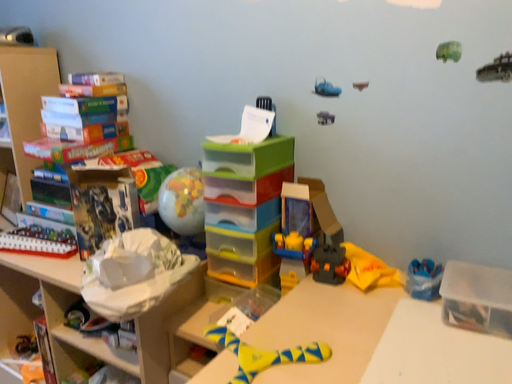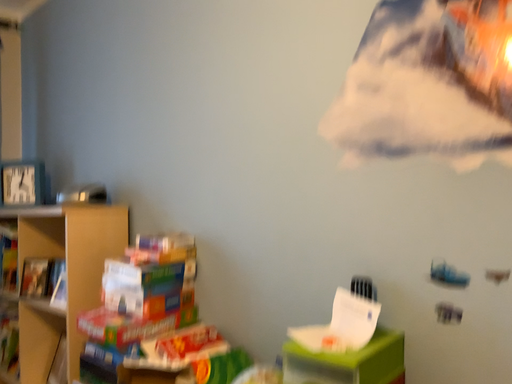
Question: Which way did the camera rotate in the video?

Choices:
 (A) rotated right
 (B) rotated left

Answer: (B)